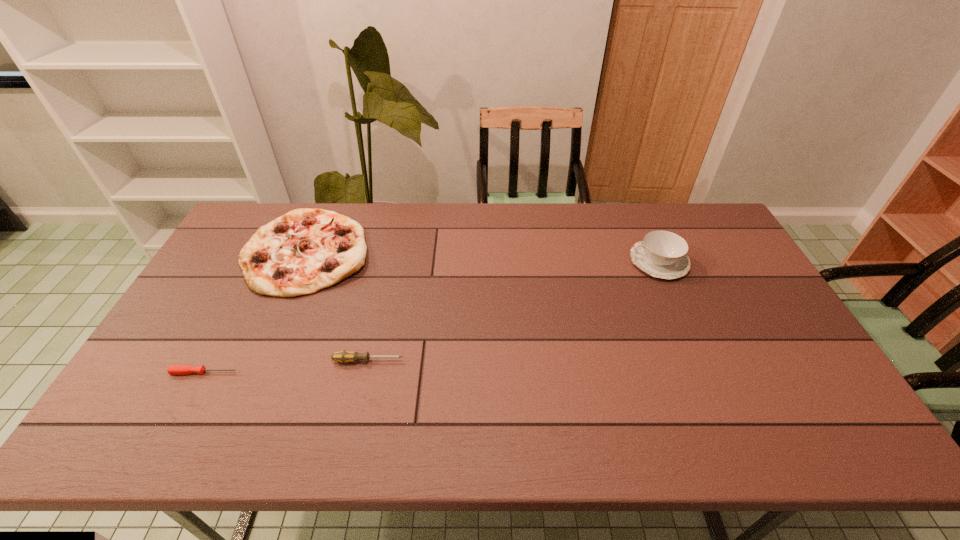
Find the location of a particular element. The image size is (960, 540). free space between the farther screwdriver and the pizza is located at coordinates (337, 306).

The image size is (960, 540). Find the location of `vacant space that is in between the shortest object and the chinaware`. vacant space that is in between the shortest object and the chinaware is located at coordinates (432, 317).

The image size is (960, 540). In order to click on free spot between the rightmost object and the second nearest object in this screenshot , I will do `click(514, 311)`.

Choose which object is the second nearest neighbor to the right screwdriver. Please provide its 2D coordinates. Your answer should be formatted as a tuple, i.e. [(x, y)], where the tuple contains the x and y coordinates of a point satisfying the conditions above.

[(173, 369)]

The width and height of the screenshot is (960, 540). I want to click on the second closest object to the shortest object, so click(x=304, y=251).